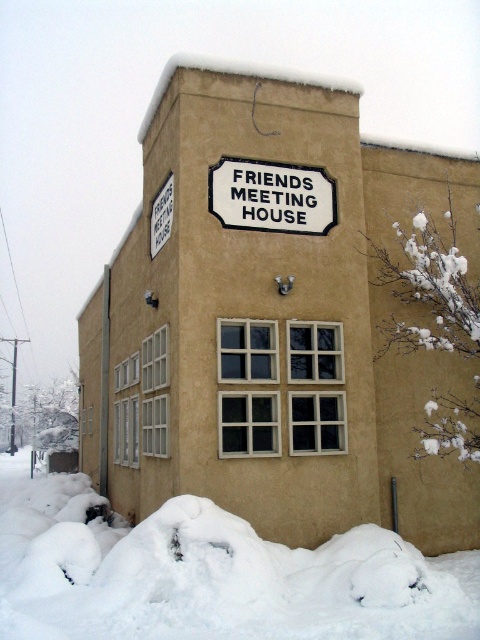
You are planning to place a new rectangular flower bed between the white fluffy snow at lower center and the white enamel sign at center. Since the snow is bigger than the sign, which object should the flower bed be closer to in order to maintain visual balance?

The flower bed should be closer to the white enamel sign at center because the white fluffy snow at lower center is bigger and would require more space to balance the composition.

You are standing in front of the FRIENDS MEETING HOUSE and want to place a small decoration on the closest object to you. Which object should you choose between the white fluffy snow at lower center and the white enamel sign at center?

The white fluffy snow at lower center is closer to the viewer than the white enamel sign at center, so you should place the decoration on the white fluffy snow at lower center.

You are standing in front of the FRIENDS MEETING HOUSE and want to place a small potted plant between the white fluffy snow at lower center and the white enamel sign at center. Based on their positions, which object should the plant be closer to?

The white fluffy snow at lower center is to the left of the white enamel sign at center, so placing the plant between them would require it to be closer to the white enamel sign at center if positioned to the right of the snow, or closer to the snow if placed to the left. However, since the snow is already at the lower center and the sign is at the center, the plant should be placed between them, closer to whichever object aligns with the desired position. But according to the description, the snow is to 1